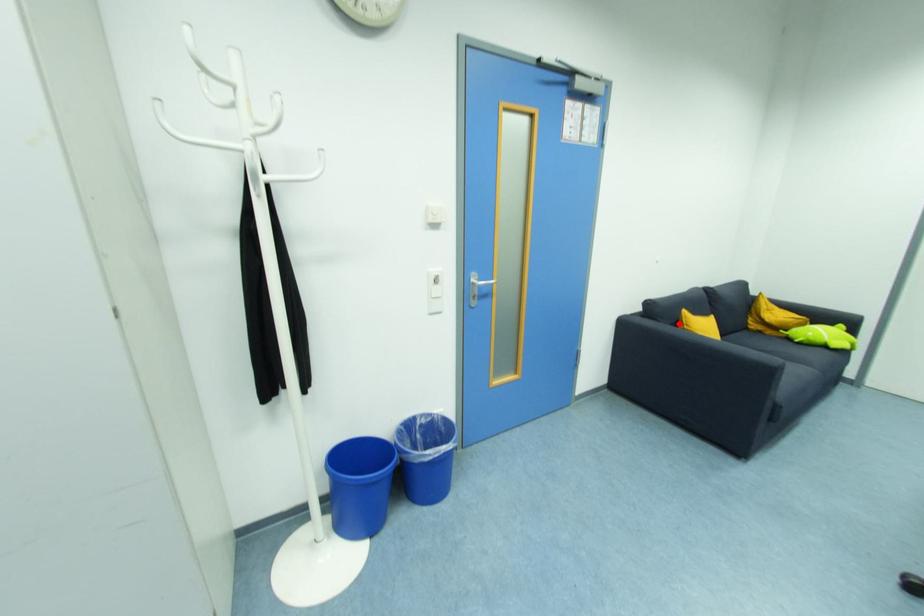
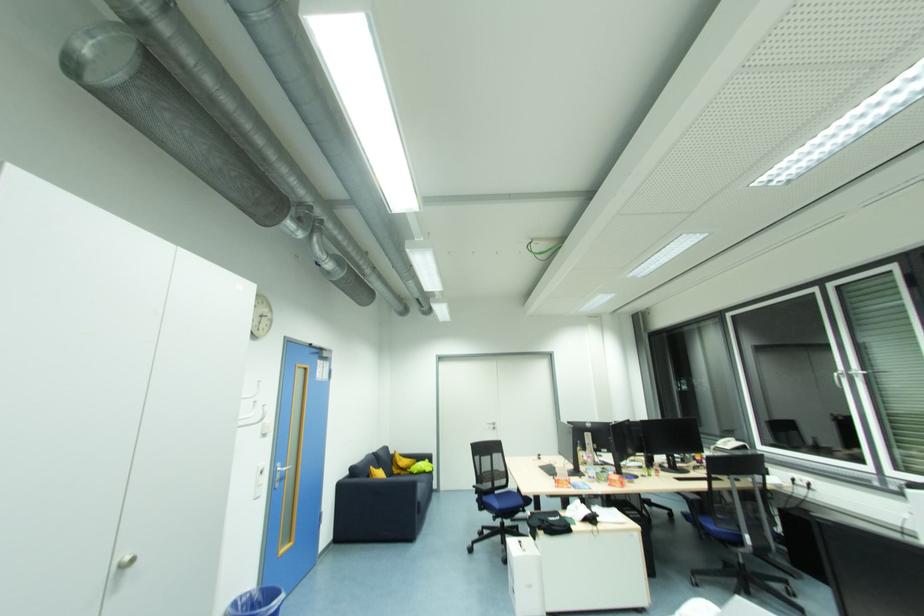
Question: A red point is marked in image1. In image2, is the corresponding 3D point closer to the camera or farther? Reply with the corresponding letter.

Choices:
 (A) The corresponding 3D point is closer.
 (B) The corresponding 3D point is farther.

Answer: (B)